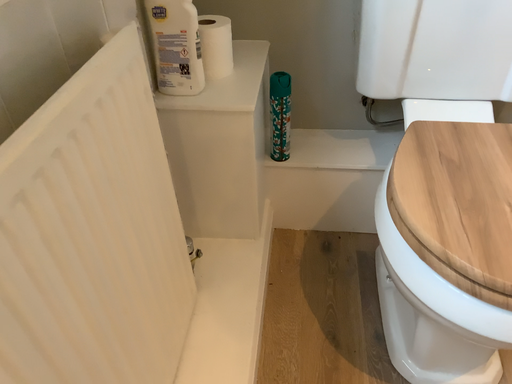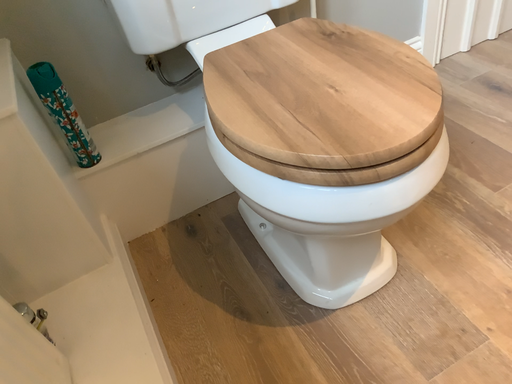
Question: How did the camera likely rotate when shooting the video?

Choices:
 (A) rotated right
 (B) rotated left

Answer: (A)